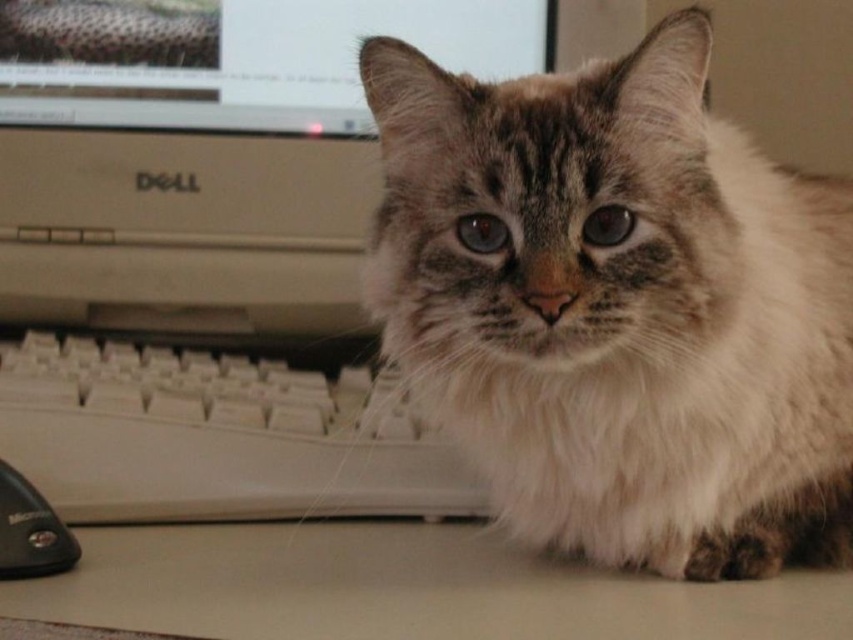
Question: Among these points, which one is nearest to the camera?

Choices:
 (A) (447, 605)
 (B) (49, 68)
 (C) (177, 444)
 (D) (775, 412)

Answer: (A)

Question: Is white matte table at lower center below black plastic mouse at lower left?

Choices:
 (A) no
 (B) yes

Answer: (B)

Question: Can you confirm if white plastic keyboard at lower center is positioned above matte plastic monitor at upper center?

Choices:
 (A) no
 (B) yes

Answer: (A)

Question: Which of the following is the closest to the observer?

Choices:
 (A) (3, 545)
 (B) (786, 445)
 (C) (287, 45)
 (D) (86, 410)

Answer: (A)

Question: Among these objects, which one is nearest to the camera?

Choices:
 (A) fuzzy fur cat at center
 (B) white plastic keyboard at lower center
 (C) white matte table at lower center
 (D) black plastic mouse at lower left

Answer: (C)

Question: Can you confirm if white plastic keyboard at lower center is positioned below matte plastic monitor at upper center?

Choices:
 (A) no
 (B) yes

Answer: (B)